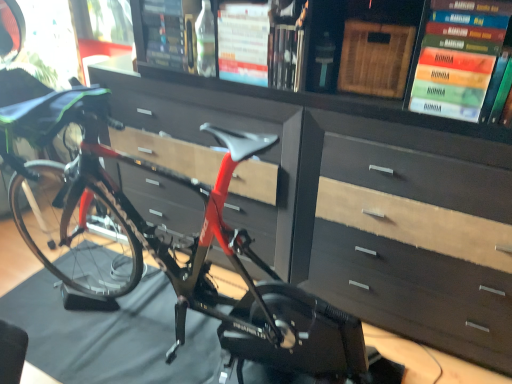
Question: Is hardcover book at upper center, the 1th book viewed from the left, thinner than hardcover book at upper center, which appears as the third book when viewed from the right?

Choices:
 (A) no
 (B) yes

Answer: (A)

Question: Does hardcover book at upper center, positioned as the 5th book in right-to-left order, have a larger size compared to hardcover book at upper center, which appears as the third book when viewed from the right?

Choices:
 (A) yes
 (B) no

Answer: (A)

Question: Is the surface of hardcover book at upper center, positioned as the 5th book in right-to-left order, in direct contact with hardcover book at upper center, the 3th book when ordered from left to right?

Choices:
 (A) yes
 (B) no

Answer: (B)

Question: From the image's perspective, is hardcover book at upper center, the 1th book viewed from the left, below hardcover book at upper center, which appears as the third book when viewed from the right?

Choices:
 (A) no
 (B) yes

Answer: (A)

Question: Considering the relative sizes of hardcover book at upper center, positioned as the 5th book in right-to-left order, and hardcover book at upper center, the 3th book when ordered from left to right, in the image provided, is hardcover book at upper center, positioned as the 5th book in right-to-left order, wider than hardcover book at upper center, the 3th book when ordered from left to right,?

Choices:
 (A) yes
 (B) no

Answer: (A)

Question: Is shiny red bike at center to the left or to the right of hardcover book at upper right, the fourth book in the left-to-right sequence, in the image?

Choices:
 (A) left
 (B) right

Answer: (A)

Question: From the image's perspective, is shiny red bike at center positioned above or below hardcover book at upper right, the fourth book in the left-to-right sequence?

Choices:
 (A) below
 (B) above

Answer: (A)

Question: Is point (53, 195) closer or farther from the camera than point (473, 115)?

Choices:
 (A) closer
 (B) farther

Answer: (B)

Question: Looking at the image, does shiny red bike at center seem bigger or smaller compared to hardcover book at upper right, the fourth book in the left-to-right sequence?

Choices:
 (A) small
 (B) big

Answer: (B)

Question: Relative to clear glass bottle at center, is hardcover book at upper right, the 1th book viewed from the right, in front or behind?

Choices:
 (A) behind
 (B) front

Answer: (B)

Question: Considering the positions of point (500, 107) and point (210, 31), is point (500, 107) closer or farther from the camera than point (210, 31)?

Choices:
 (A) closer
 (B) farther

Answer: (A)

Question: Would you say hardcover book at upper right, arranged as the fifth book when viewed from the left, is inside or outside clear glass bottle at center?

Choices:
 (A) outside
 (B) inside

Answer: (A)

Question: From the image's perspective, relative to clear glass bottle at center, is hardcover book at upper right, arranged as the fifth book when viewed from the left, above or below?

Choices:
 (A) above
 (B) below

Answer: (B)

Question: Is point (110, 276) closer or farther from the camera than point (261, 33)?

Choices:
 (A) closer
 (B) farther

Answer: (B)

Question: From a real-world perspective, is shiny red bike at center positioned above or below hardcover book at center, which ranks as the fourth book in right-to-left order?

Choices:
 (A) below
 (B) above

Answer: (A)